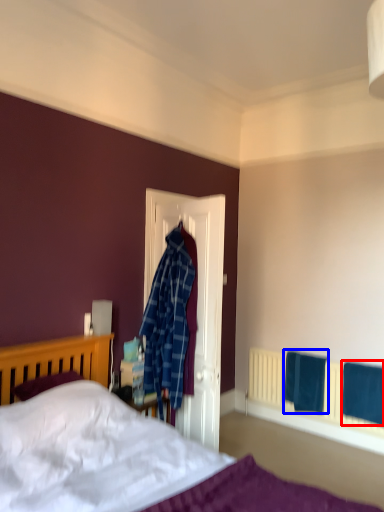
Question: Which object appears closest to the camera in this image, bath towel (highlighted by a red box) or bath towel (highlighted by a blue box)?

Choices:
 (A) bath towel
 (B) bath towel

Answer: (A)